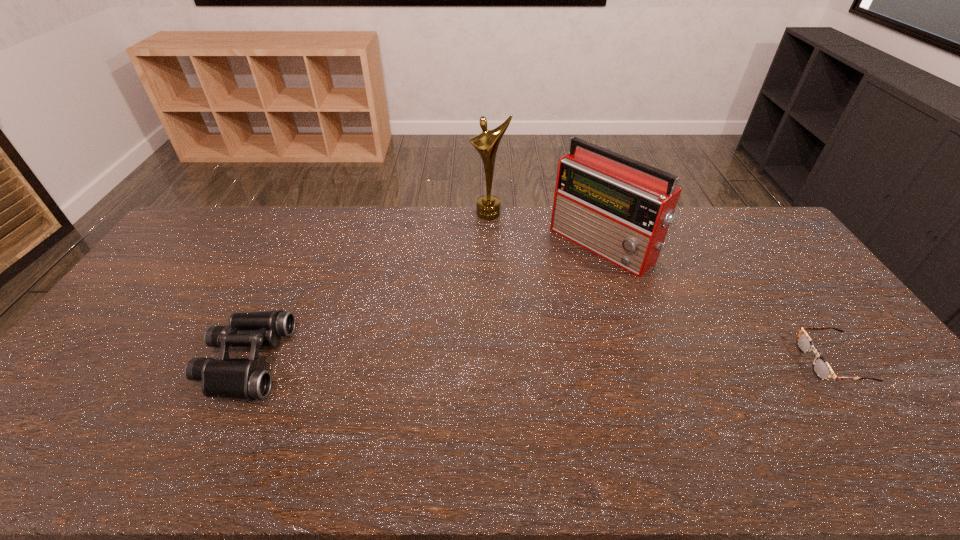
I want to click on vacant area at the far edge of the desktop, so click(x=299, y=218).

This screenshot has height=540, width=960. What are the coordinates of `vacant space at the near edge of the desktop` in the screenshot? It's located at (177, 407).

Locate an element on the screen. vacant space at the right edge of the desktop is located at coordinates (763, 268).

In the image, there is a desktop. In order to click on vacant space at the far left corner in this screenshot , I will do `click(210, 213)`.

The height and width of the screenshot is (540, 960). Find the location of `free space between the award and the radio receiver`. free space between the award and the radio receiver is located at coordinates (545, 229).

In order to click on vacant area that lies between the radio receiver and the leftmost object in this screenshot , I will do `click(423, 302)`.

The image size is (960, 540). Find the location of `free spot between the award and the third tallest object`. free spot between the award and the third tallest object is located at coordinates 367,287.

In order to click on vacant area that lies between the second shortest object and the third object from right to left in this screenshot , I will do `click(367, 287)`.

Where is `vacant space that is in between the third tallest object and the spectacles`? This screenshot has height=540, width=960. vacant space that is in between the third tallest object and the spectacles is located at coordinates (538, 361).

Where is `vacant point located between the spectacles and the second object from right to left`? The width and height of the screenshot is (960, 540). vacant point located between the spectacles and the second object from right to left is located at coordinates (717, 303).